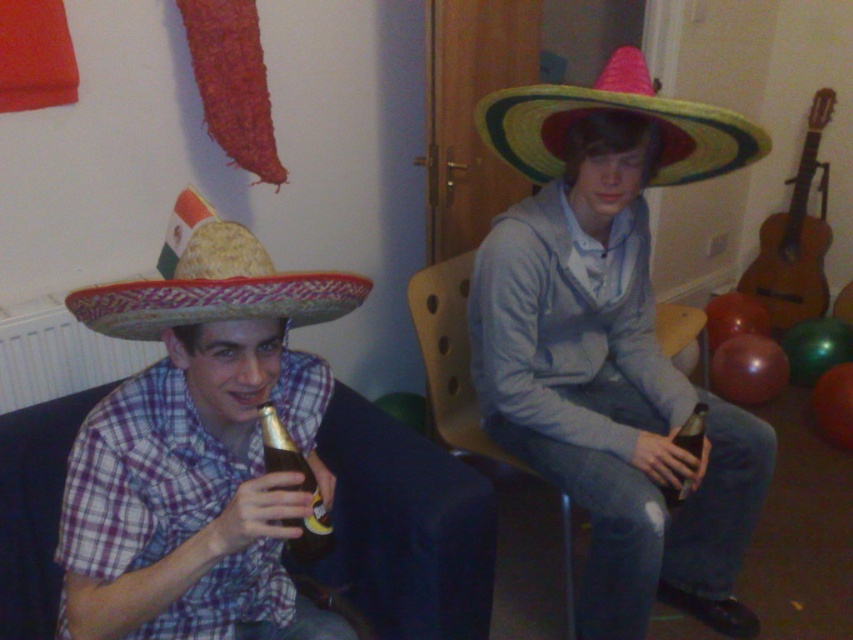
Question: Which of the following is the farthest from the observer?

Choices:
 (A) (140, 337)
 (B) (582, 109)
 (C) (669, 499)
 (D) (316, 513)

Answer: (C)

Question: Does matte gray hoodie at center appear over multicolored straw sombrero at upper right?

Choices:
 (A) no
 (B) yes

Answer: (A)

Question: Does wooden chair at center have a larger size compared to brown glass bottle at lower left?

Choices:
 (A) yes
 (B) no

Answer: (A)

Question: Is the position of plaid fabric shirt at left more distant than that of brown glass bottle at right?

Choices:
 (A) no
 (B) yes

Answer: (A)

Question: Among these objects, which one is farthest from the camera?

Choices:
 (A) plaid fabric shirt at left
 (B) wooden chair at center
 (C) multicolored straw sombrero at upper right

Answer: (B)

Question: Which of these objects is positioned closest to the plaid fabric shirt at left?

Choices:
 (A) brown glass bottle at lower left
 (B) brown glass bottle at right
 (C) strawhat at left

Answer: (A)